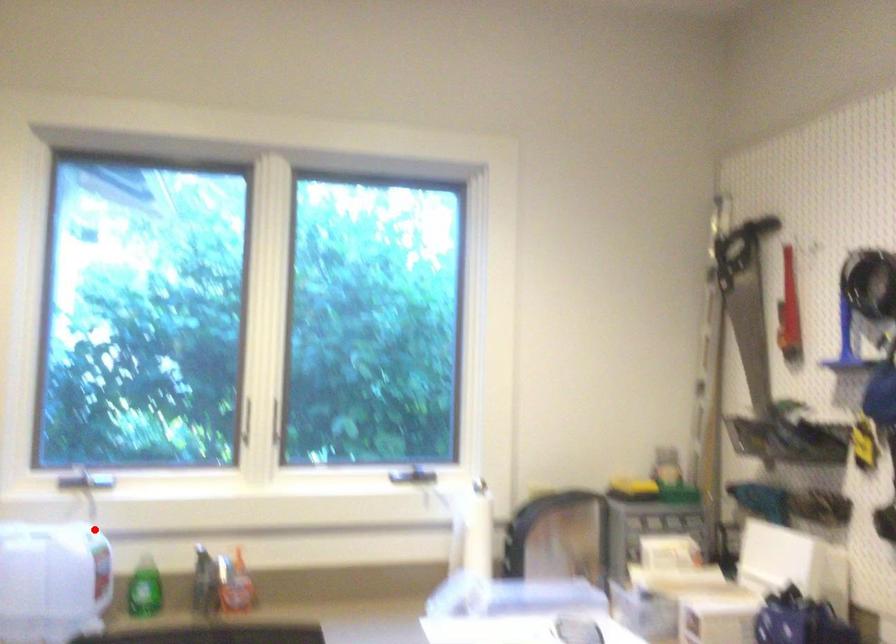
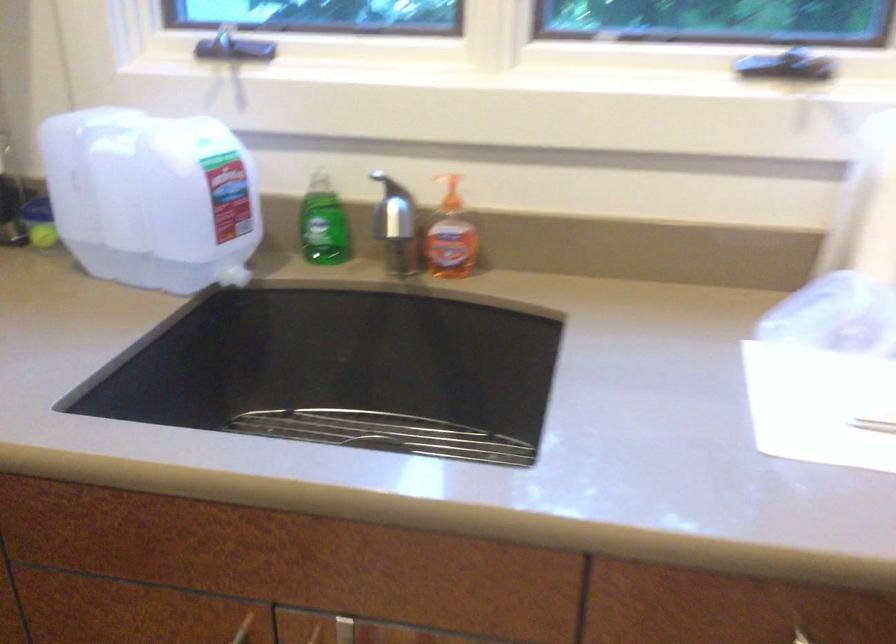
Where in the second image is the point corresponding to the highlighted location from the first image?

(220, 135)